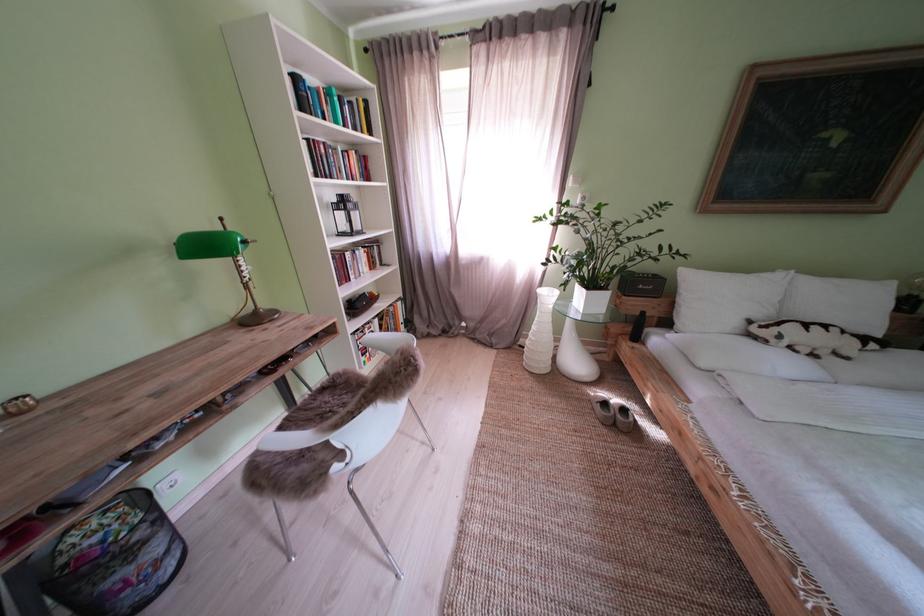
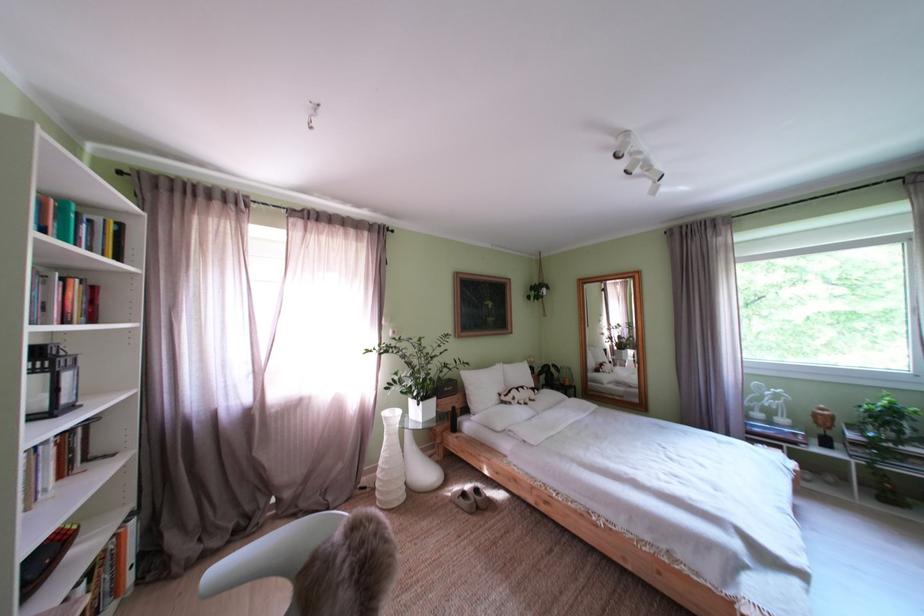
Locate, in the second image, the point that corresponds to point 589,368 in the first image.

(438, 479)